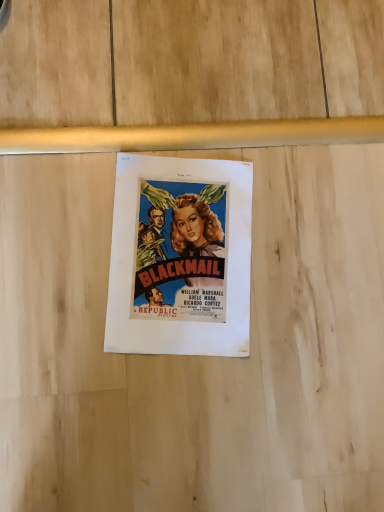
Where is `matte paper poster at center`? This screenshot has width=384, height=512. matte paper poster at center is located at coordinates (180, 257).

What do you see at coordinates (180, 257) in the screenshot? I see `matte paper poster at center` at bounding box center [180, 257].

Find the location of a particular element. matte paper poster at center is located at coordinates (180, 257).